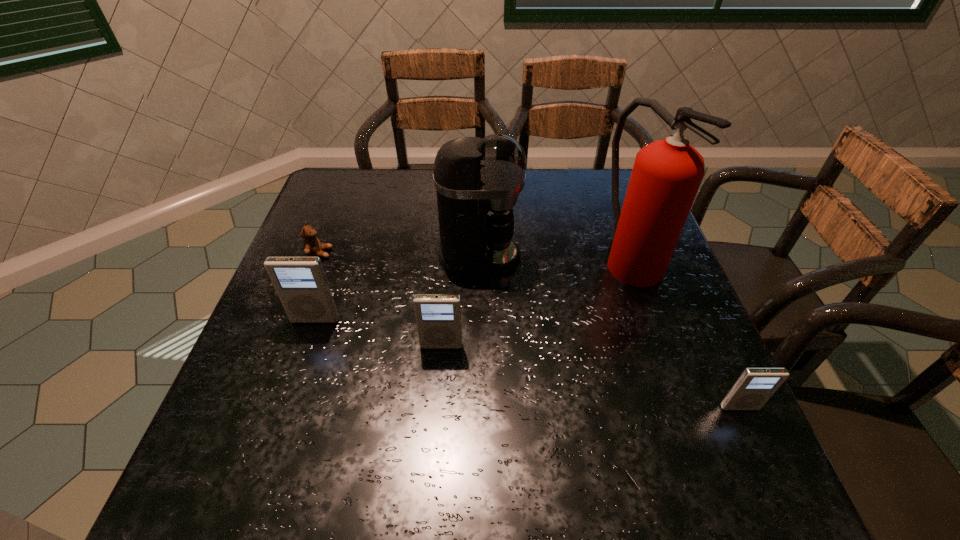
You are a GUI agent. You are given a task and a screenshot of the screen. Output one action in this format:
    pyautogui.click(x=<x>, y=<y>)
    Task: Click on the free space located 0.080m on the front-facing side of the third shortest object
    This screenshot has height=540, width=960.
    Given the screenshot: What is the action you would take?
    pyautogui.click(x=439, y=384)

Where is `blank space located 0.240m on the handle side of the tallest object`? The image size is (960, 540). blank space located 0.240m on the handle side of the tallest object is located at coordinates (675, 383).

You are a GUI agent. You are given a task and a screenshot of the screen. Output one action in this format:
    pyautogui.click(x=<x>, y=<y>)
    Task: Click on the vacant space situated place cup under the spout of the coffee maker
    
    Given the screenshot: What is the action you would take?
    pyautogui.click(x=612, y=256)

Identify the location of blank space located on the front-facing side of the shortest object. The width and height of the screenshot is (960, 540). (387, 253).

You are a GUI agent. You are given a task and a screenshot of the screen. Output one action in this format:
    pyautogui.click(x=<x>, y=<y>)
    Task: Click on the object located in the near edge section of the desktop
    
    Given the screenshot: What is the action you would take?
    pyautogui.click(x=755, y=386)

Identify the location of iPod located in the left edge section of the desktop. This screenshot has height=540, width=960. (301, 284).

Find the location of a particular element. This screenshot has width=960, height=540. teddy bear at the left edge is located at coordinates (312, 247).

Image resolution: width=960 pixels, height=540 pixels. I want to click on iPod located at the right edge, so click(x=755, y=386).

In order to click on fire extinguisher located in the right edge section of the desktop in this screenshot , I will do `click(666, 176)`.

Where is `object situated at the near right corner`? object situated at the near right corner is located at coordinates (755, 386).